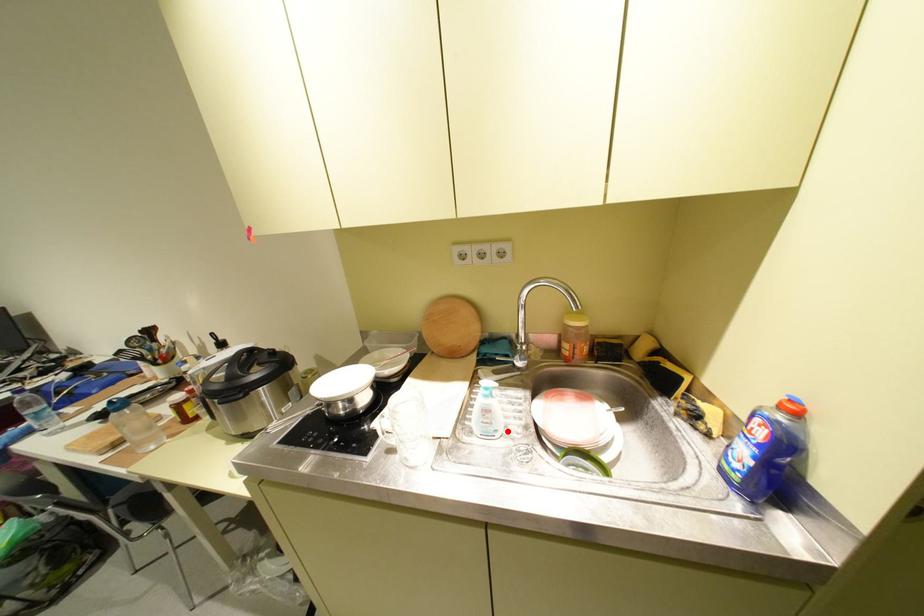
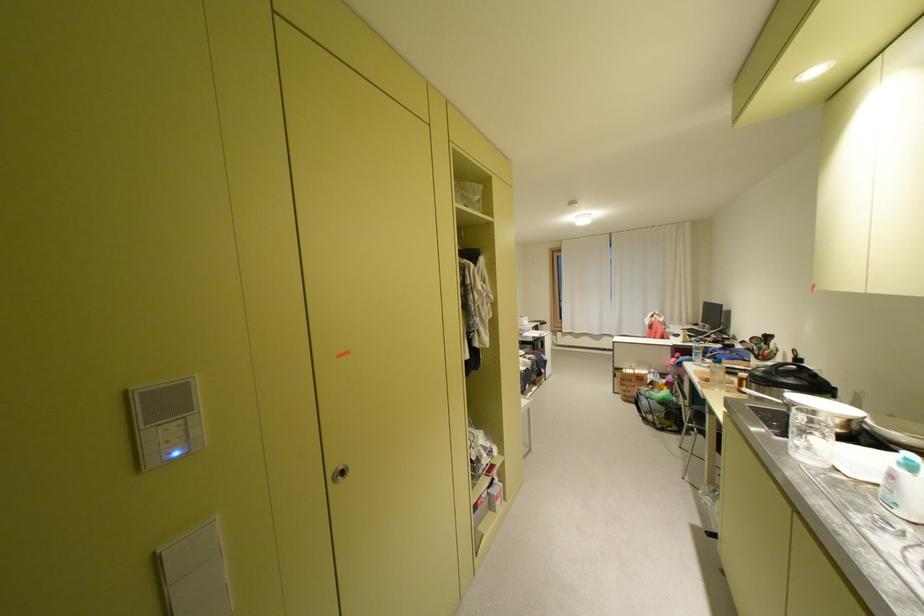
Question: I am providing you with two images of the same scene from different viewpoints. A red point is marked on the first image. At the location where the point appears in image 1, is it still visible in image 2?

Choices:
 (A) Yes
 (B) No

Answer: (A)